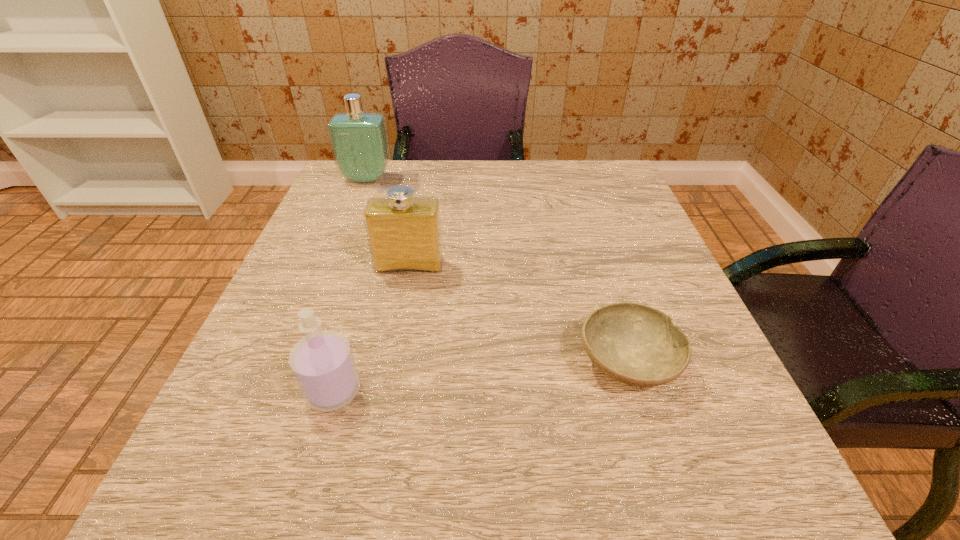
The height and width of the screenshot is (540, 960). I want to click on the farthest object, so click(x=359, y=141).

You are a GUI agent. You are given a task and a screenshot of the screen. Output one action in this format:
    pyautogui.click(x=<x>, y=<y>)
    Task: Click on the second farthest object
    This screenshot has height=540, width=960.
    Given the screenshot: What is the action you would take?
    pyautogui.click(x=404, y=234)

Where is `the nearest perfume`? the nearest perfume is located at coordinates (322, 362).

You are a GUI agent. You are given a task and a screenshot of the screen. Output one action in this format:
    pyautogui.click(x=<x>, y=<y>)
    Task: Click on the shortest perfume
    The width and height of the screenshot is (960, 540).
    Given the screenshot: What is the action you would take?
    pyautogui.click(x=322, y=362)

The height and width of the screenshot is (540, 960). What are the coordinates of `bowl` in the screenshot? It's located at (636, 344).

Locate an element on the screen. This screenshot has width=960, height=540. the shortest object is located at coordinates (636, 344).

Find the location of a particular element. This screenshot has width=960, height=540. free space located on the front label of the farthest object is located at coordinates (332, 266).

This screenshot has height=540, width=960. What are the coordinates of `vacant space positioned on the front-facing side of the third nearest object` in the screenshot? It's located at (371, 474).

The height and width of the screenshot is (540, 960). Identify the location of vacant region located 0.080m on the back of the third tallest object. (351, 329).

The image size is (960, 540). In order to click on vacant space situated 0.170m on the left of the shortest object in this screenshot , I will do `click(467, 362)`.